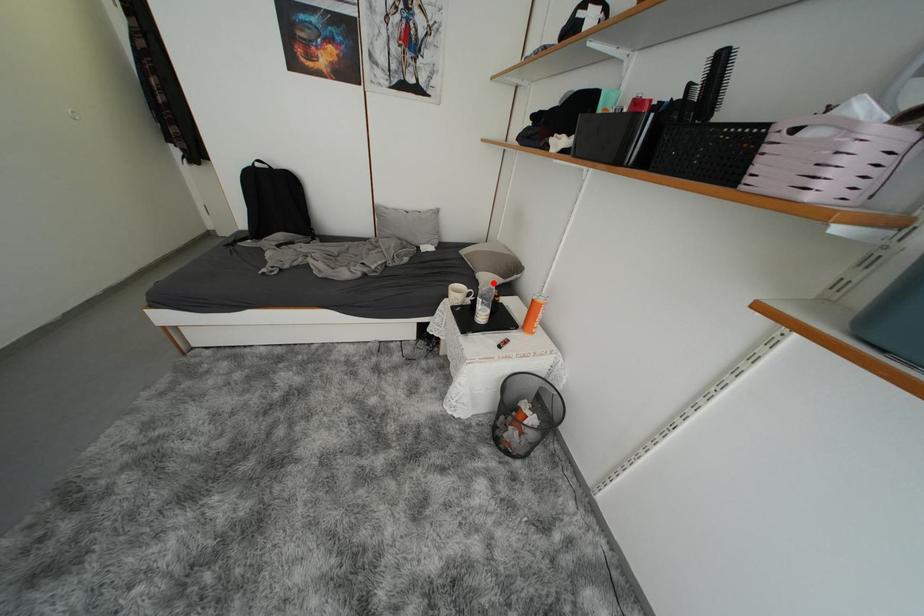
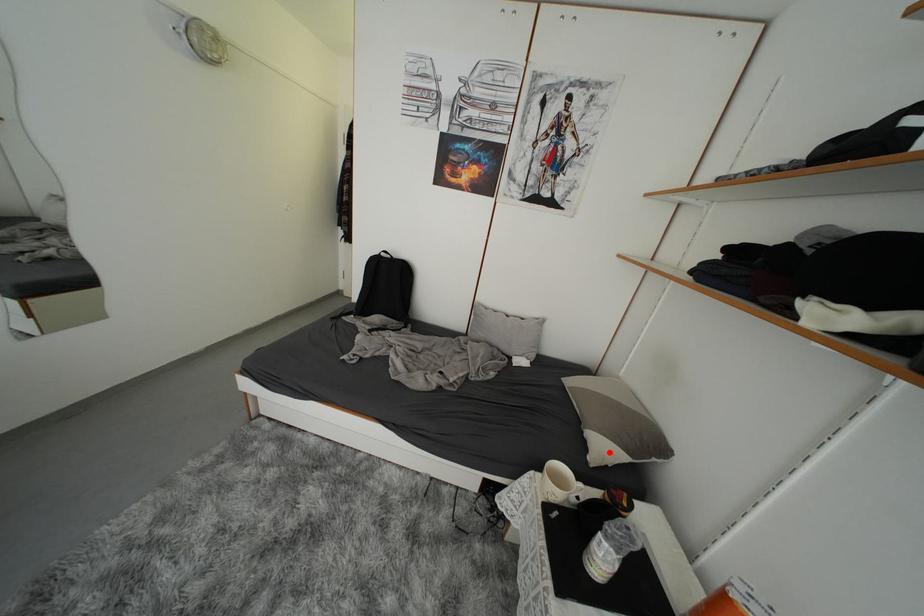
I am providing you with two images of the same scene from different viewpoints. A red point is marked on the first image and another point is marked on the second image. Is the red point in image1 aligned with the point shown in image2?

Yes